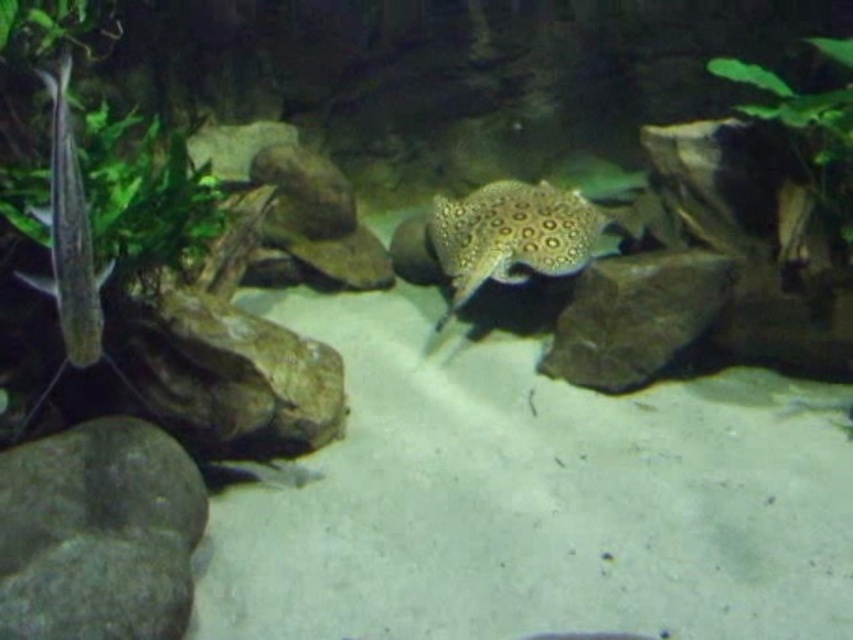
Question: Which object is positioned farthest from the gray matte rock at lower left?

Choices:
 (A) smooth gray rock at center
 (B) green leafy plant at left
 (C) translucent white fish at left

Answer: (A)

Question: Estimate the real-world distances between objects in this image. Which object is closer to the smooth gray rock at left?

Choices:
 (A) green leafy plant at left
 (B) shiny golden stingray at center

Answer: (A)

Question: Estimate the real-world distances between objects in this image. Which object is farther from the translucent white fish at left?

Choices:
 (A) gray matte rock at lower left
 (B) smooth gray rock at left

Answer: (B)

Question: Can you confirm if shiny golden stingray at center is wider than green leafy plant at upper right?

Choices:
 (A) no
 (B) yes

Answer: (B)

Question: Can you confirm if gray matte rock at lower left is positioned to the right of translucent white fish at left?

Choices:
 (A) yes
 (B) no

Answer: (A)

Question: Can you confirm if gray matte rock at lower left is positioned below green leafy plant at left?

Choices:
 (A) no
 (B) yes

Answer: (B)